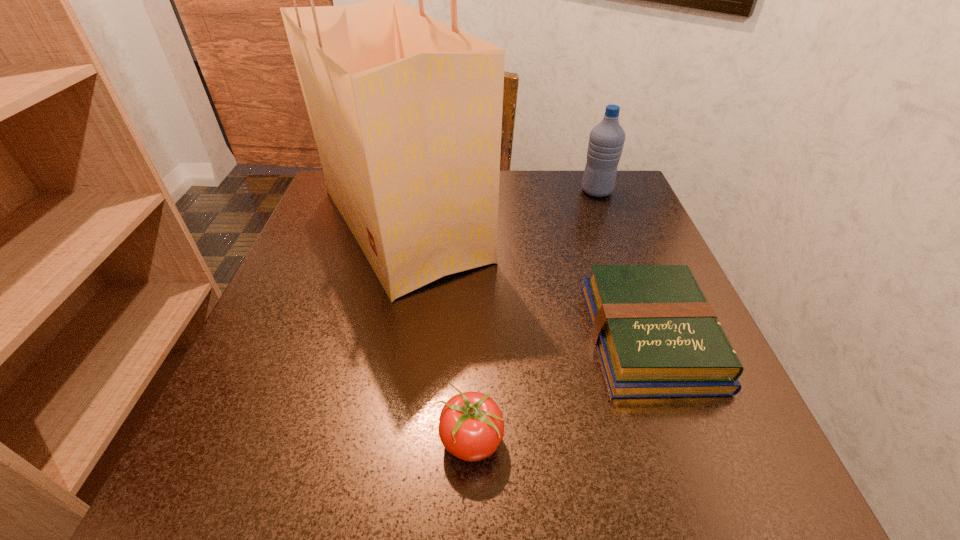
Where is `free point between the book and the third tallest object`? Image resolution: width=960 pixels, height=540 pixels. free point between the book and the third tallest object is located at coordinates (560, 389).

What are the coordinates of `unoccupied area between the grocery bag and the tomato` in the screenshot? It's located at (437, 333).

Locate an element on the screen. The height and width of the screenshot is (540, 960). unoccupied position between the tallest object and the shortest object is located at coordinates (527, 281).

Locate an element on the screen. This screenshot has height=540, width=960. free space between the tomato and the grocery bag is located at coordinates (437, 333).

Where is `unoccupied area between the book and the nearest object`? unoccupied area between the book and the nearest object is located at coordinates (560, 389).

What are the coordinates of `object identified as the third closest to the second tallest object` in the screenshot? It's located at (471, 426).

The width and height of the screenshot is (960, 540). I want to click on object that can be found as the second closest to the tallest object, so click(606, 141).

Find the location of a particular element. Image resolution: width=960 pixels, height=540 pixels. free region that satisfies the following two spatial constraints: 1. on the side of the shortest object with the superhero design; 2. on the right side of the grocery bag is located at coordinates (379, 336).

Identify the location of free space that satisfies the following two spatial constraints: 1. on the side of the grocery bag with the superhero design; 2. on the back side of the tomato. (356, 441).

Locate an element on the screen. This screenshot has width=960, height=540. free location that satisfies the following two spatial constraints: 1. on the back side of the second shortest object; 2. on the left side of the book is located at coordinates (472, 336).